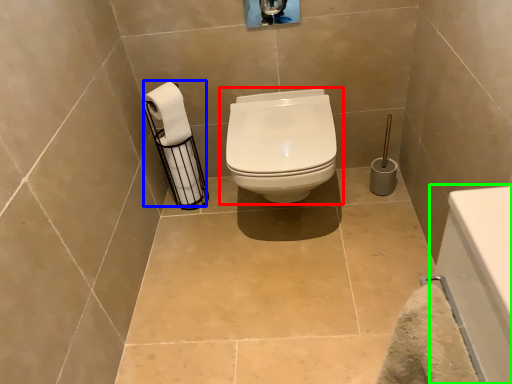
Question: Which object is positioned closest to toilet (highlighted by a red box)? Select from toilet paper (highlighted by a blue box) and bath (highlighted by a green box).

Choices:
 (A) toilet paper
 (B) bath

Answer: (A)